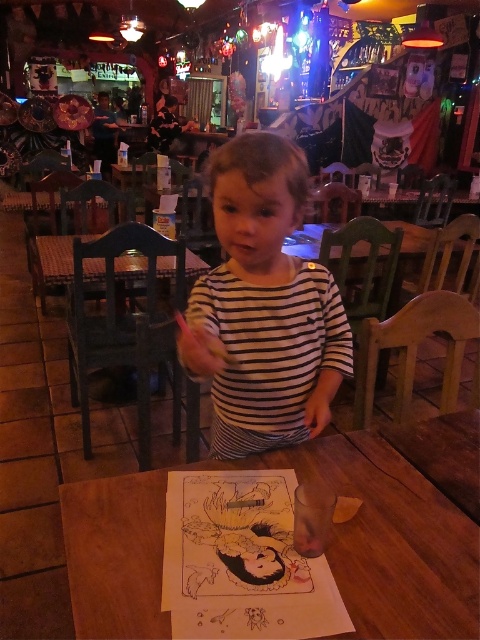
Does wooden table at center have a lesser height compared to white striped shirt at center?

Correct, wooden table at center is not as tall as white striped shirt at center.

This screenshot has width=480, height=640. Describe the element at coordinates (396, 525) in the screenshot. I see `wooden table at center` at that location.

Find the location of a particular element. This screenshot has width=480, height=640. wooden table at center is located at coordinates (396, 525).

Identify the location of wooden table at center. The width and height of the screenshot is (480, 640). (396, 525).